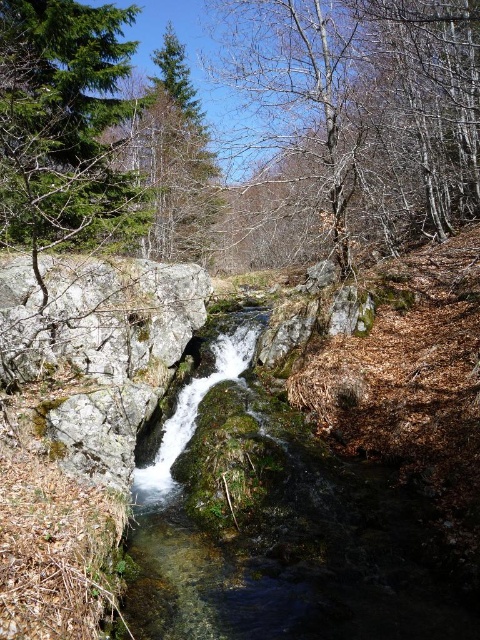
Does clear water at center have a lesser height compared to bare branches at upper center?

Yes.

Does clear water at center have a greater height compared to bare branches at upper center?

No.

Which is in front, point (262, 592) or point (323, 147)?

Point (262, 592) is more forward.

The image size is (480, 640). I want to click on clear water at center, so click(x=280, y=538).